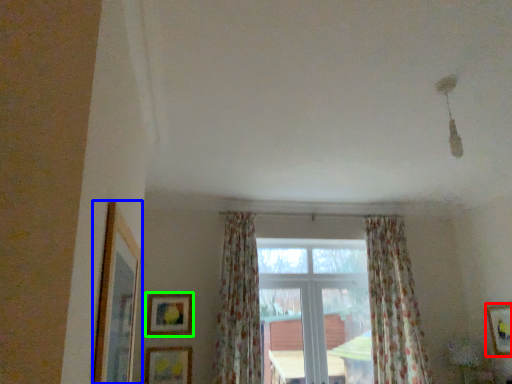
Question: Which object is positioned farthest from picture frame (highlighted by a red box)? Select from picture frame (highlighted by a blue box) and picture frame (highlighted by a green box).

Choices:
 (A) picture frame
 (B) picture frame

Answer: (A)